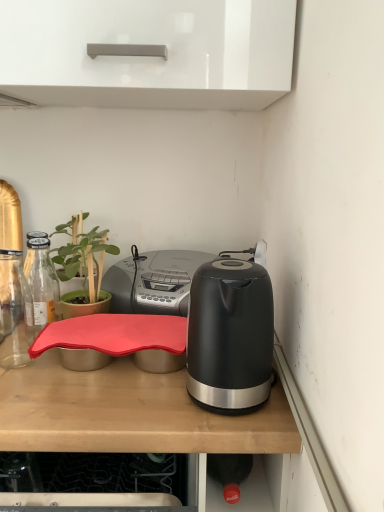
The width and height of the screenshot is (384, 512). In order to click on matte black kettle at right in this screenshot , I will do `click(153, 281)`.

Does black glossy kettle at right have a larger size compared to matte black kettle at right?

No, black glossy kettle at right is not bigger than matte black kettle at right.

Considering the positions of objects black glossy kettle at right and matte black kettle at right in the image provided, who is in front, black glossy kettle at right or matte black kettle at right?

black glossy kettle at right.

Is black glossy kettle at right located outside matte black kettle at right?

Yes, black glossy kettle at right is not within matte black kettle at right.

Is there a large distance between black glossy kettle at right and matte black kettle at right?

They are positioned close to each other.

Looking at this image, are rubberized red tray at center and green matte plant at left located far from each other?

Actually, rubberized red tray at center and green matte plant at left are a little close together.

Is point (201, 471) closer to camera compared to point (69, 312)?

Yes, it is in front of point (69, 312).

Can you confirm if rubberized red tray at center is shorter than green matte plant at left?

Incorrect, the height of rubberized red tray at center does not fall short of that of green matte plant at left.

From a real-world perspective, who is located higher, rubberized red tray at center or green matte plant at left?

From a 3D spatial view, green matte plant at left is above.

Which object is further away from the camera taking this photo, green matte plant at left or black glossy kettle at right?

Positioned behind is green matte plant at left.

Is green matte plant at left aimed at black glossy kettle at right?

No, green matte plant at left is not oriented towards black glossy kettle at right.

From the image's perspective, is green matte plant at left located above or below black glossy kettle at right?

From the image's perspective, green matte plant at left appears above black glossy kettle at right.

What are the coordinates of `kitchen appliance that appears on the right of green matte plant at left` in the screenshot? It's located at pos(231,334).

Which object is further away from the camera taking this photo, matte black kettle at right or black glossy kettle at right?

matte black kettle at right.

Does matte black kettle at right turn towards black glossy kettle at right?

Yes, matte black kettle at right is aimed at black glossy kettle at right.

Which is farther from the camera, [128,262] or [193,335]?

The point [128,262] is more distant.

In terms of height, does matte black kettle at right look taller or shorter compared to green matte plant at left?

Considering their sizes, matte black kettle at right has less height than green matte plant at left.

Where is `houseplant above the matte black kettle at right (from a real-world perspective)`? houseplant above the matte black kettle at right (from a real-world perspective) is located at coordinates (83, 270).

Does matte black kettle at right have a lesser width compared to green matte plant at left?

No.

Could you tell me if matte black kettle at right is facing green matte plant at left?

No, matte black kettle at right is not turned towards green matte plant at left.

From the image's perspective, is rubberized red tray at center over black glossy kettle at right?

No, from the image's perspective, rubberized red tray at center is not over black glossy kettle at right.

Considering the points (285, 419) and (231, 309), which point is in front, point (285, 419) or point (231, 309)?

The point (231, 309) is more forward.

Is black glossy kettle at right a part of rubberized red tray at center?

No, rubberized red tray at center does not contain black glossy kettle at right.

Does rubberized red tray at center appear on the right side of black glossy kettle at right?

Incorrect, rubberized red tray at center is not on the right side of black glossy kettle at right.

Can you see green matte plant at left touching matte black kettle at right?

No.

Is green matte plant at left facing towards matte black kettle at right?

No, green matte plant at left is not turned towards matte black kettle at right.

How far apart are green matte plant at left and matte black kettle at right?

They are 4.94 inches apart.

From the image's perspective, between green matte plant at left and matte black kettle at right, which one is located above?

green matte plant at left appears higher in the image.

You are a GUI agent. You are given a task and a screenshot of the screen. Output one action in this format:
    pyautogui.click(x=<x>, y=<y>)
    Task: Click on the appliance below the black glossy kettle at right (from a real-world perspective)
    
    Given the screenshot: What is the action you would take?
    pyautogui.click(x=153, y=281)

The height and width of the screenshot is (512, 384). In the image, there is a rubberized red tray at center. What are the coordinates of `houseplant above it (from the image's perspective)` in the screenshot? It's located at (83, 270).

In the scene shown: When comparing their distances from green matte plant at left, does rubberized red tray at center or matte black kettle at right seem closer?

matte black kettle at right is closer to green matte plant at left.

Based on their spatial positions, is matte black kettle at right or rubberized red tray at center further from black glossy kettle at right?

matte black kettle at right is positioned further to the anchor black glossy kettle at right.

When comparing their distances from rubberized red tray at center, does black glossy kettle at right or green matte plant at left seem closer?

Based on the image, black glossy kettle at right appears to be nearer to rubberized red tray at center.

Based on their spatial positions, is green matte plant at left or black glossy kettle at right closer to rubberized red tray at center?

black glossy kettle at right is positioned closer to the anchor rubberized red tray at center.

Looking at the image, which one is located closer to rubberized red tray at center, matte black kettle at right or black glossy kettle at right?

black glossy kettle at right is closer to rubberized red tray at center.

Based on their spatial positions, is rubberized red tray at center or black glossy kettle at right closer to matte black kettle at right?

rubberized red tray at center is positioned closer to the anchor matte black kettle at right.

When comparing their distances from green matte plant at left, does matte black kettle at right or rubberized red tray at center seem further?

Among the two, rubberized red tray at center is located further to green matte plant at left.

Looking at the image, which one is located further to black glossy kettle at right, rubberized red tray at center or green matte plant at left?

green matte plant at left is positioned further to the anchor black glossy kettle at right.

Where is `houseplant between black glossy kettle at right and matte black kettle at right from front to back`? houseplant between black glossy kettle at right and matte black kettle at right from front to back is located at coordinates (83, 270).

What are the coordinates of `kitchen appliance between matte black kettle at right and rubberized red tray at center vertically` in the screenshot? It's located at pos(231,334).

Image resolution: width=384 pixels, height=512 pixels. I want to click on kitchen appliance that lies between green matte plant at left and rubberized red tray at center from top to bottom, so click(x=231, y=334).

You are a GUI agent. You are given a task and a screenshot of the screen. Output one action in this format:
    pyautogui.click(x=<x>, y=<y>)
    Task: Click on the appliance between green matte plant at left and rubberized red tray at center vertically
    This screenshot has height=512, width=384.
    Given the screenshot: What is the action you would take?
    pyautogui.click(x=153, y=281)